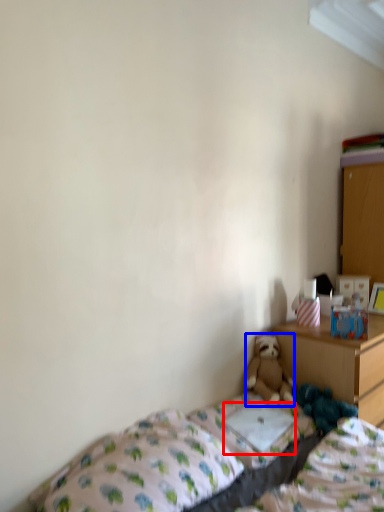
Question: Which object is further to the camera taking this photo, pillow (highlighted by a red box) or teddy bear (highlighted by a blue box)?

Choices:
 (A) pillow
 (B) teddy bear

Answer: (B)